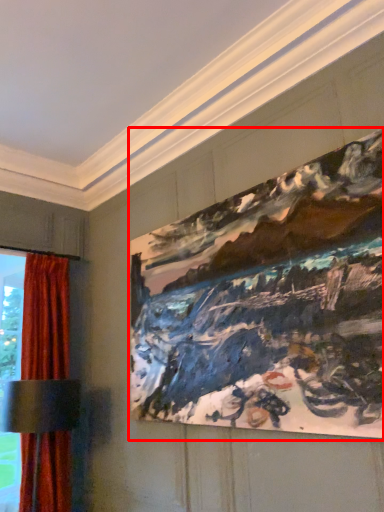
Question: From the image, what is the correct spatial relationship of picture frame (annotated by the red box) in relation to curtain?

Choices:
 (A) right
 (B) left

Answer: (A)